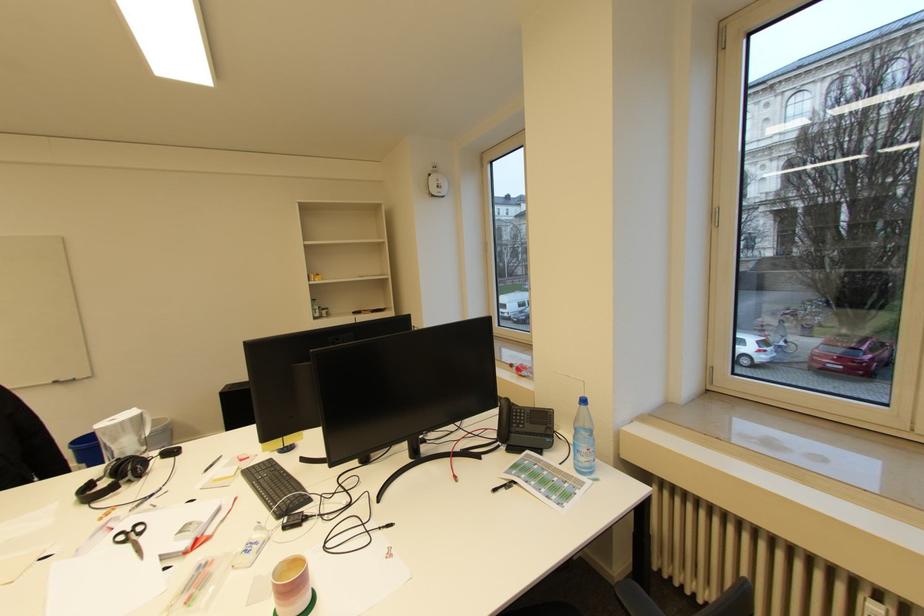
What do you see at coordinates (582, 440) in the screenshot? This screenshot has width=924, height=616. I see `the small sanitizer bottle` at bounding box center [582, 440].